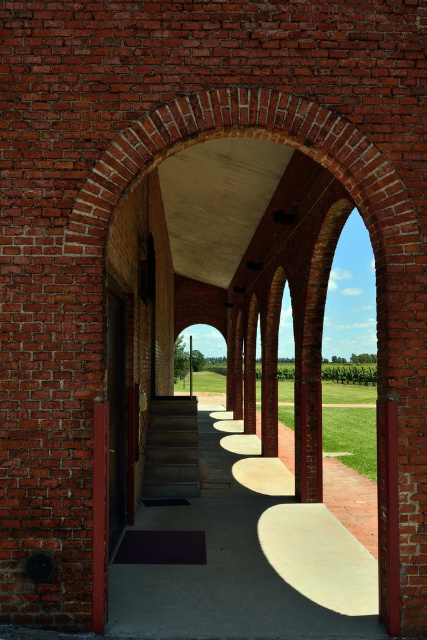
Can you confirm if concrete sidewalk at center is positioned to the left of concrete stairs at center?

In fact, concrete sidewalk at center is to the right of concrete stairs at center.

Is concrete sidewalk at center positioned behind concrete stairs at center?

No.

Where is `concrete sidewalk at center`? The width and height of the screenshot is (427, 640). concrete sidewalk at center is located at coordinates (246, 556).